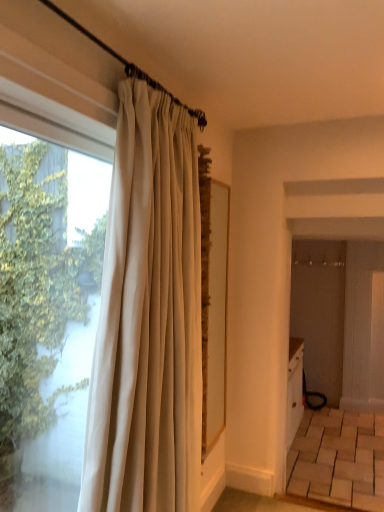
Question: In the image, is white silk curtain at left on the left side or the right side of transparent glass window at left?

Choices:
 (A) left
 (B) right

Answer: (B)

Question: Is white silk curtain at left taller or shorter than transparent glass window at left?

Choices:
 (A) tall
 (B) short

Answer: (A)

Question: Based on their sizes in the image, would you say white silk curtain at left is bigger or smaller than transparent glass window at left?

Choices:
 (A) small
 (B) big

Answer: (B)

Question: From the image's perspective, is transparent glass window at left above or below white silk curtain at left?

Choices:
 (A) above
 (B) below

Answer: (A)

Question: In the image, is transparent glass window at left positioned in front of or behind white silk curtain at left?

Choices:
 (A) behind
 (B) front

Answer: (B)

Question: Is point (43, 446) closer or farther from the camera than point (150, 301)?

Choices:
 (A) closer
 (B) farther

Answer: (B)

Question: Is transparent glass window at left to the left or to the right of white silk curtain at left in the image?

Choices:
 (A) right
 (B) left

Answer: (B)